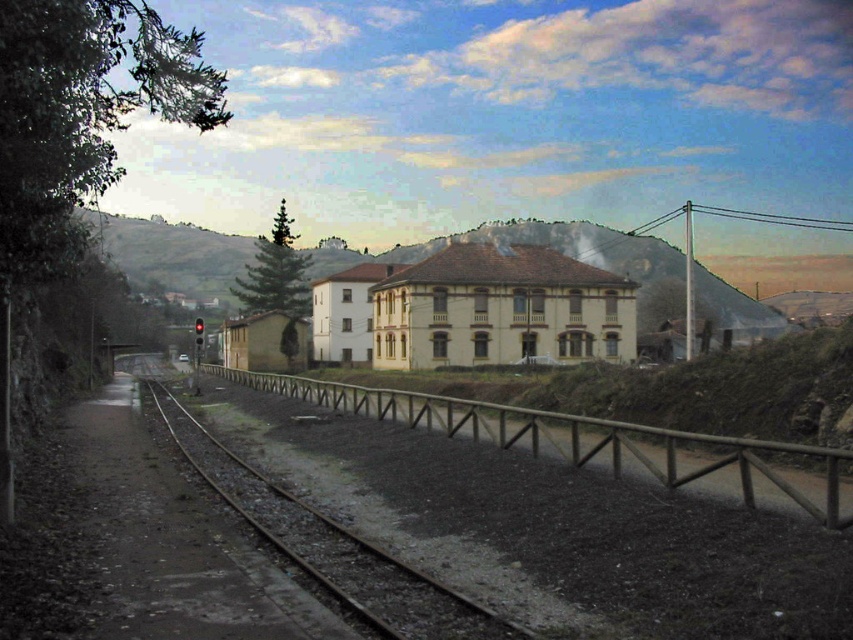
Question: Which of the following is the farthest from the observer?

Choices:
 (A) (534, 637)
 (B) (817, 460)

Answer: (B)

Question: Does brown wooden rail at center have a smaller size compared to brown wooden track at center?

Choices:
 (A) yes
 (B) no

Answer: (B)

Question: Which point is closer to the camera?

Choices:
 (A) brown wooden rail at center
 (B) brown wooden track at center

Answer: (B)

Question: Is brown wooden rail at center to the right of brown wooden track at center from the viewer's perspective?

Choices:
 (A) yes
 (B) no

Answer: (B)

Question: Is brown wooden rail at center thinner than brown wooden track at center?

Choices:
 (A) no
 (B) yes

Answer: (A)